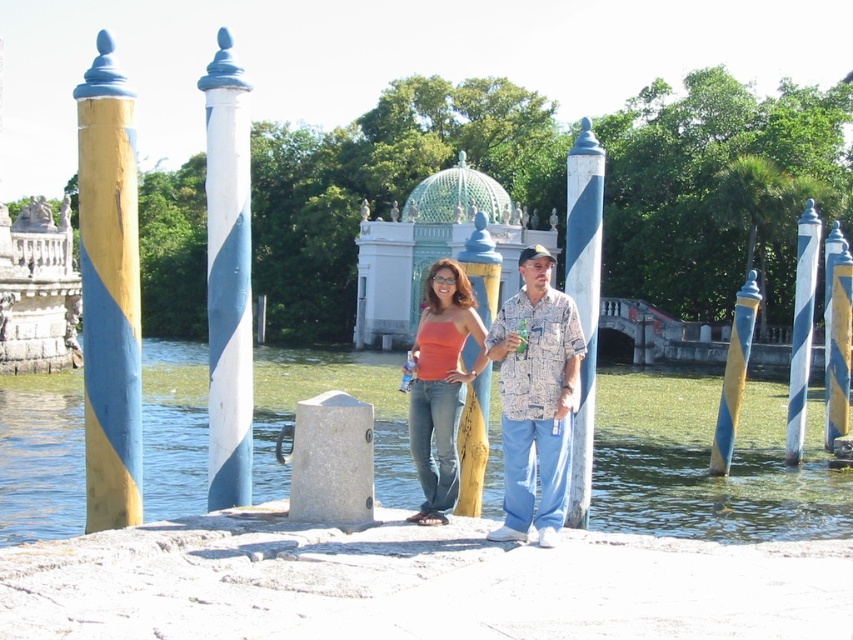
You are standing at the waterfront and see the green mosaic dome at center and the yellow painted wood post at center. Which object is positioned to the left?

The green mosaic dome at center is positioned to the left of the yellow painted wood post at center.

You are a visitor at the waterfront and want to take a photo of the green mosaic dome at center and the yellow painted wood post at center. Which object should you focus on first if you want to capture both in a single frame without moving the camera?

The green mosaic dome at center is located above the yellow painted wood post at center, so you should focus on the yellow painted wood post at center first to ensure both are in the frame.